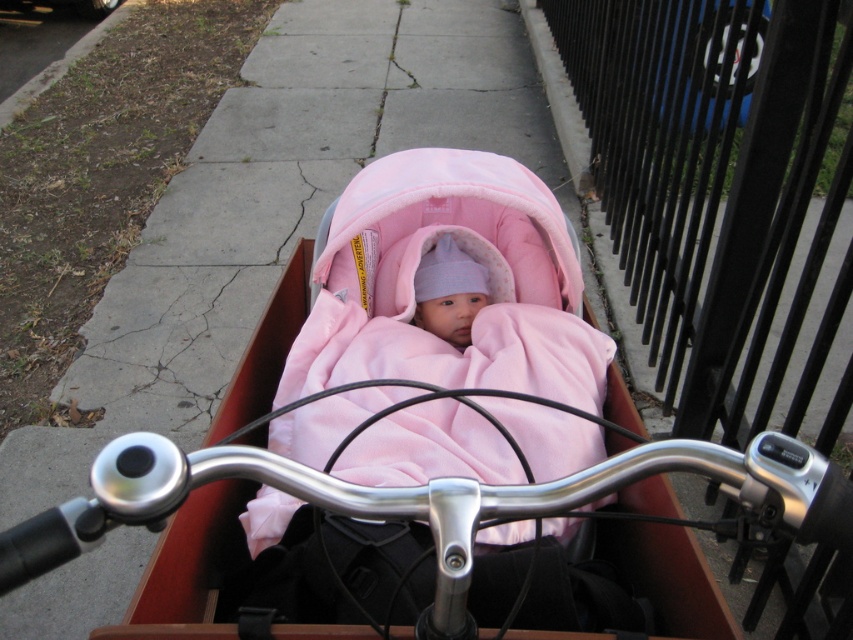
Between matte pink fabric baby carriage at center and polished silver handlebars at center, which one appears on the right side from the viewer's perspective?

From the viewer's perspective, matte pink fabric baby carriage at center appears more on the right side.

Between matte pink fabric baby carriage at center and polished silver handlebars at center, which one appears on the left side from the viewer's perspective?

From the viewer's perspective, polished silver handlebars at center appears more on the left side.

Which is in front, point (398, 173) or point (451, 509)?

Point (451, 509) is in front.

Locate an element on the screen. The width and height of the screenshot is (853, 640). matte pink fabric baby carriage at center is located at coordinates (476, 291).

Is point (404, 282) in front of point (424, 257)?

That is True.

Between point (537, 408) and point (434, 324), which one is positioned in front?

Positioned in front is point (537, 408).

At what (x,y) coordinates should I click in order to perform the action: click on matte pink fabric baby carriage at center. Please return your answer as a coordinate pair (x, y). The width and height of the screenshot is (853, 640). Looking at the image, I should click on (476, 291).

Is polished silver handlebars at center closer to camera compared to pink fleece baby at center?

Yes, it is in front of pink fleece baby at center.

Is point (392, 497) closer to viewer compared to point (434, 288)?

Yes, it is.

Which is in front, point (233, 476) or point (428, 259)?

Point (233, 476)

Locate an element on the screen. Image resolution: width=853 pixels, height=640 pixels. polished silver handlebars at center is located at coordinates (425, 500).